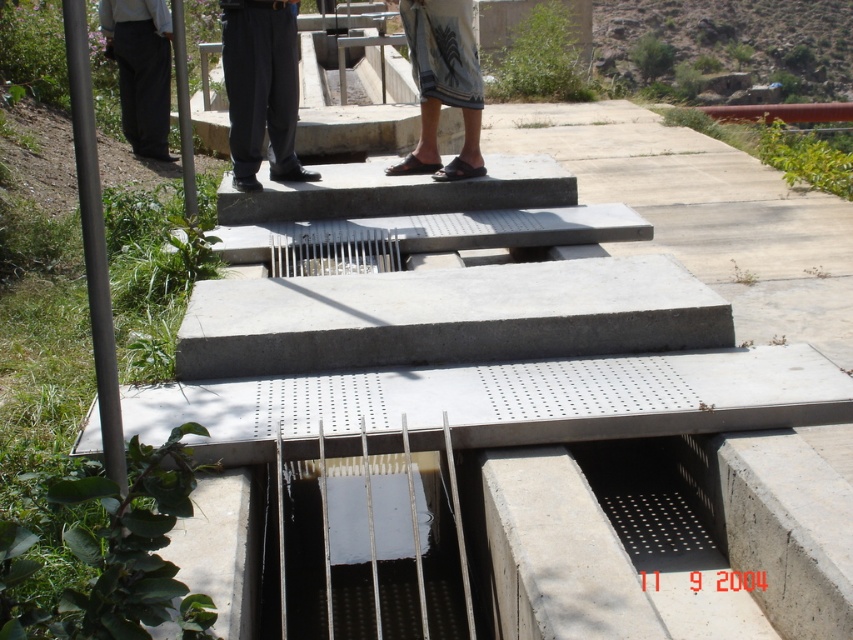
You are a maintenance worker inspecting the water channel. You notice the white woven cloth at center and the dark gray pants at left near the edge. Which object is narrower in width?

The white woven cloth at center has a lesser width compared to dark gray pants at left, so the white woven cloth at center is narrower.

You are standing at the edge of the water channel and want to reach the point marked as point [244,20]. Given that the distance from your current position to that point is 16.49 feet, can you estimate how far you need to walk to reach it?

The point [244,20] is 16.49 feet away from your current position, so you need to walk approximately 16.49 feet to reach it.